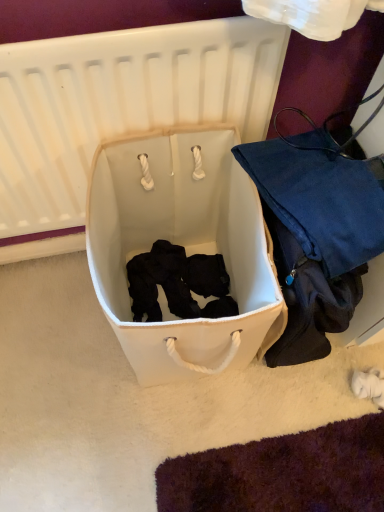
Question: From their relative heights in the image, would you say white fabric laundry basket at center is taller or shorter than white fabric infant bed at center?

Choices:
 (A) short
 (B) tall

Answer: (A)

Question: Considering the relative positions of white fabric laundry basket at center and white fabric infant bed at center in the image provided, is white fabric laundry basket at center to the left or to the right of white fabric infant bed at center?

Choices:
 (A) right
 (B) left

Answer: (A)

Question: Which object is the closest to the white fabric laundry basket at center?

Choices:
 (A) matte blue fabric bag at right
 (B) white fabric infant bed at center

Answer: (A)

Question: Which object is the closest to the white fabric laundry basket at center?

Choices:
 (A) white fabric infant bed at center
 (B) matte blue fabric bag at right

Answer: (B)